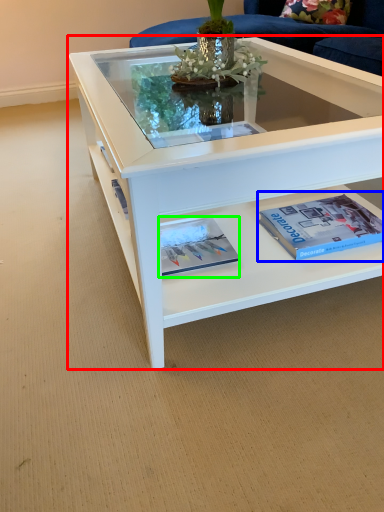
Question: Based on their relative distances, which object is farther from coffee table (highlighted by a red box)? Choose from paperback book (highlighted by a blue box) and magazine (highlighted by a green box).

Choices:
 (A) paperback book
 (B) magazine

Answer: (B)